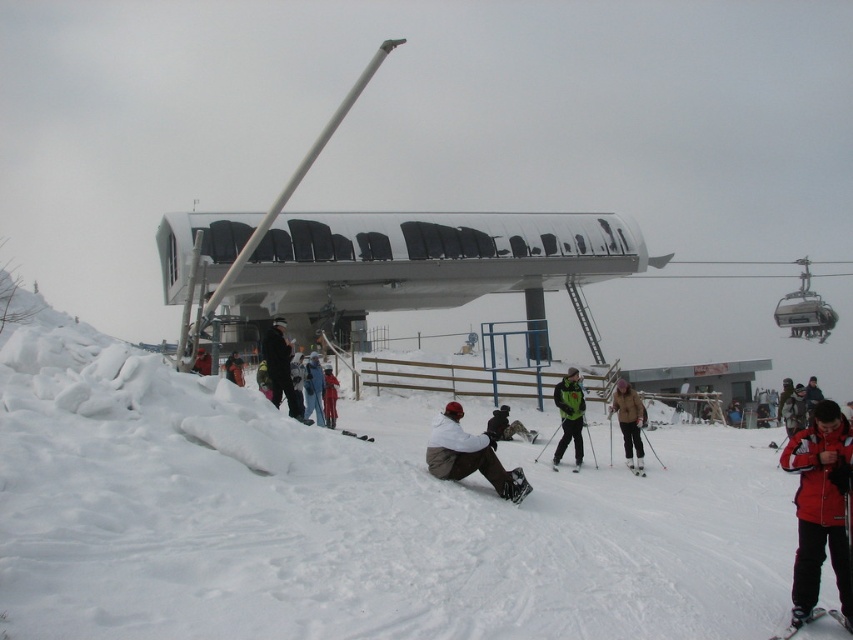
You are a drone operator trying to capture a photo of the orange ski suit at center and the white powdery snow at lower left. The camera has a maximum focus range of 40 feet. Can you capture both subjects in focus without moving the drone?

The distance between the white powdery snow at lower left and orange ski suit at center is 42.79 feet, which exceeds the camera maximum focus range of 40 feet. Therefore, the drone cannot capture both subjects in focus without moving.

You are standing at the camera position and want to reach point (560, 406). Is the distance more than 70 feet?

Yes, the distance between the camera and point (560, 406) is 71.87 feet, which is more than 70 feet.